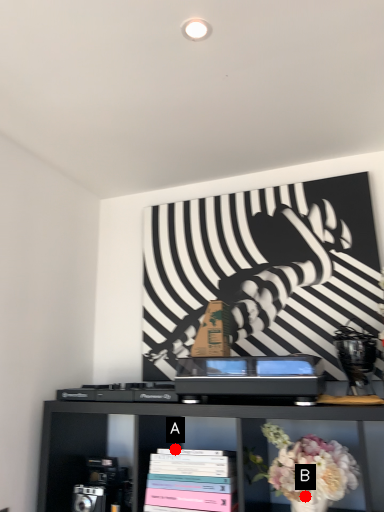
Question: Two points are circled on the image, labeled by A and B beside each circle. Which point appears farthest from the camera in this image?

Choices:
 (A) A is further
 (B) B is further

Answer: (A)